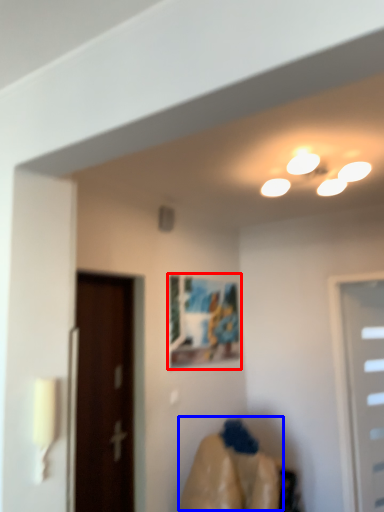
Question: Among these objects, which one is farthest to the camera, picture frame (highlighted by a red box) or woman (highlighted by a blue box)?

Choices:
 (A) picture frame
 (B) woman

Answer: (A)